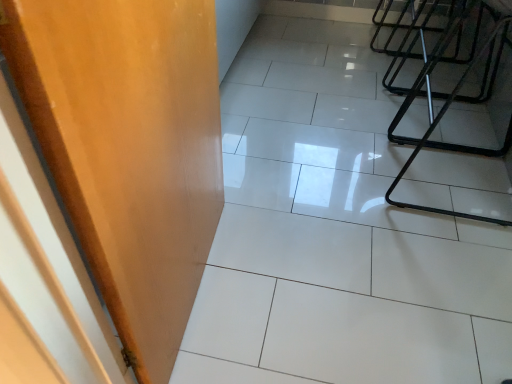
Question: In terms of width, does white glossy tile at center look wider or thinner when compared to wooden door at left?

Choices:
 (A) wide
 (B) thin

Answer: (A)

Question: Is white glossy tile at center situated inside wooden door at left or outside?

Choices:
 (A) inside
 (B) outside

Answer: (B)

Question: Is point (245, 324) positioned closer to the camera than point (150, 365)?

Choices:
 (A) closer
 (B) farther

Answer: (B)

Question: Is wooden door at left wider or thinner than white glossy tile at center?

Choices:
 (A) thin
 (B) wide

Answer: (A)

Question: Is wooden door at left situated inside white glossy tile at center or outside?

Choices:
 (A) outside
 (B) inside

Answer: (A)

Question: Is point (152, 226) positioned closer to the camera than point (488, 205)?

Choices:
 (A) closer
 (B) farther

Answer: (A)

Question: Relative to white glossy tile at center, is wooden door at left in front or behind?

Choices:
 (A) front
 (B) behind

Answer: (A)